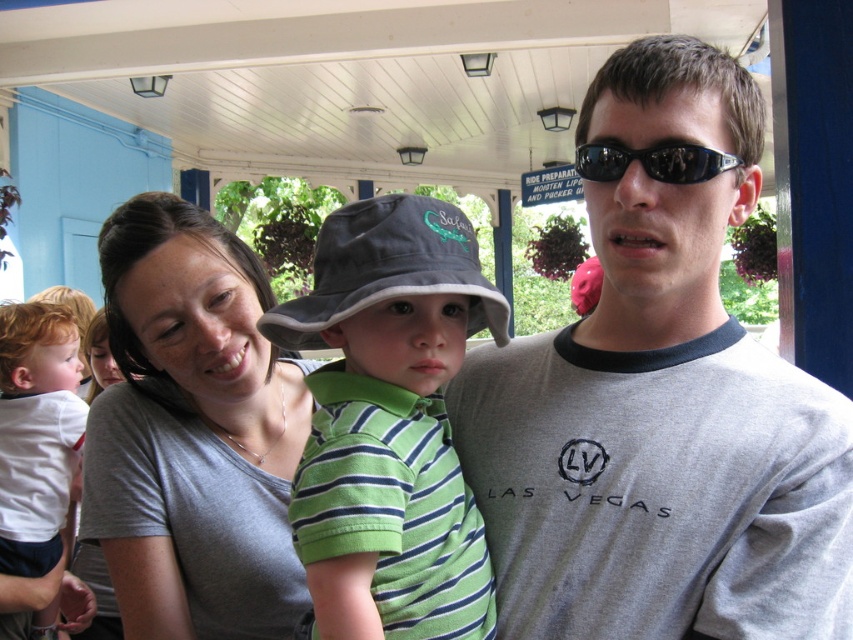
Is point (682, 54) positioned in front of point (643, 156)?

No, (682, 54) is further to viewer.

Is gray cotton t-shirt at right smaller than black plastic sunglasses at center?

Incorrect, gray cotton t-shirt at right is not smaller in size than black plastic sunglasses at center.

Who is more distant from viewer, (751,600) or (581,150)?

The point (581,150) is more distant.

Locate an element on the screen. Image resolution: width=853 pixels, height=640 pixels. gray cotton t-shirt at right is located at coordinates (660, 406).

Which of these two, matte gray shirt at center or black plastic sunglasses at center, stands shorter?

With less height is black plastic sunglasses at center.

Does point (134, 548) come closer to viewer compared to point (705, 154)?

No.

At what (x,y) coordinates should I click in order to perform the action: click on matte gray shirt at center. Please return your answer as a coordinate pair (x, y). The image size is (853, 640). Looking at the image, I should click on (193, 433).

Between gray cotton t-shirt at right and white cotton shirt at left, which one is positioned lower?

white cotton shirt at left

Looking at this image, who is positioned more to the left, gray cotton t-shirt at right or white cotton shirt at left?

white cotton shirt at left is more to the left.

Between point (801, 516) and point (78, 346), which one is positioned in front?

Point (801, 516) is more forward.

Identify the location of gray cotton t-shirt at right. Image resolution: width=853 pixels, height=640 pixels. (660, 406).